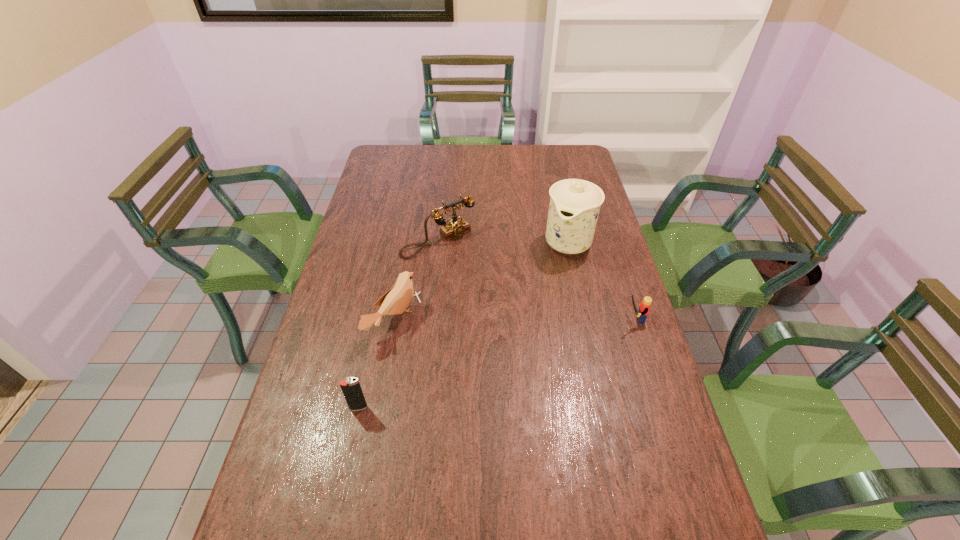
The height and width of the screenshot is (540, 960). Find the location of `vacant area that lies between the Lego and the telephone`. vacant area that lies between the Lego and the telephone is located at coordinates (536, 280).

Locate an element on the screen. This screenshot has height=540, width=960. free space between the bird and the Lego is located at coordinates (514, 320).

This screenshot has height=540, width=960. I want to click on free space between the chinaware and the bird, so click(481, 281).

The height and width of the screenshot is (540, 960). In order to click on vacant region between the telephone and the bird in this screenshot , I will do `click(417, 280)`.

Locate an element on the screen. The height and width of the screenshot is (540, 960). blank region between the igniter and the bird is located at coordinates (376, 364).

Where is `vacant area between the igniter and the telephone`? The width and height of the screenshot is (960, 540). vacant area between the igniter and the telephone is located at coordinates (398, 324).

The height and width of the screenshot is (540, 960). Identify the location of empty location between the igniter and the Lego. (495, 363).

Locate an element on the screen. free space between the telephone and the bird is located at coordinates (417, 280).

The image size is (960, 540). Identify the location of free space between the bird and the rightmost object. (514, 320).

Identify the location of object that stands as the closest to the bird. (456, 227).